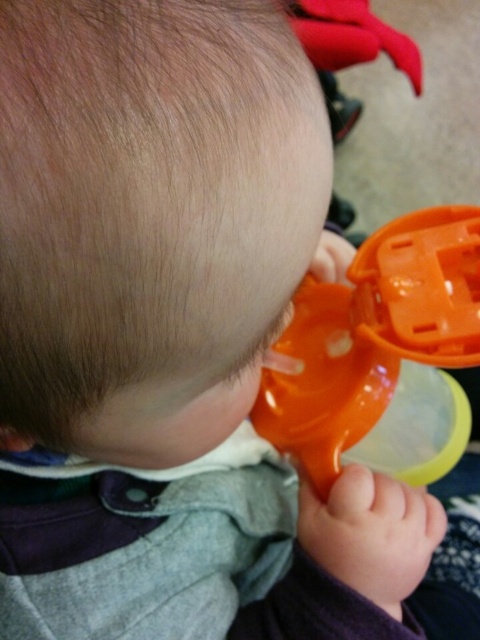
Question: Can you confirm if orange plastic sippy cup at lower right is bigger than rubberized plastic sippy cup at upper center?

Choices:
 (A) yes
 (B) no

Answer: (B)

Question: Does orange plastic sippy cup at lower right appear on the right side of rubberized plastic sippy cup at upper center?

Choices:
 (A) no
 (B) yes

Answer: (A)

Question: Which point appears closest to the camera in this image?

Choices:
 (A) (364, 48)
 (B) (479, 344)

Answer: (B)

Question: Which of the following is the closest to the observer?

Choices:
 (A) rubberized plastic sippy cup at upper center
 (B) orange plastic sippy cup at lower right

Answer: (B)

Question: Is orange plastic sippy cup at lower right closer to the viewer compared to rubberized plastic sippy cup at upper center?

Choices:
 (A) no
 (B) yes

Answer: (B)